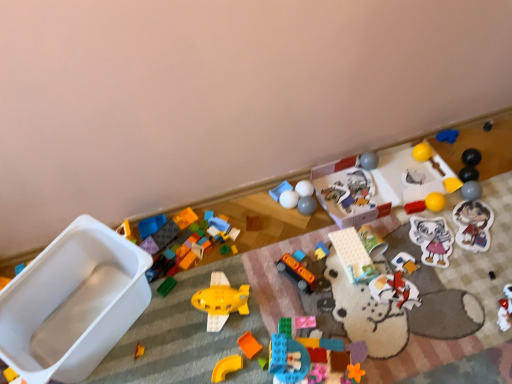
Question: Considering the relative positions of translucent plastic blocks at center, positioned as the 15th toy in right-to-left order, and orange matte bus at center, the tenth toy when ordered from left to right, in the image provided, is translucent plastic blocks at center, positioned as the 15th toy in right-to-left order, to the left or to the right of orange matte bus at center, the tenth toy when ordered from left to right,?

Choices:
 (A) right
 (B) left

Answer: (A)

Question: From the image's perspective, is translucent plastic blocks at center, arranged as the 11th toy when viewed from the left, positioned above or below orange matte bus at center, the sixteenth toy in the right-to-left sequence?

Choices:
 (A) below
 (B) above

Answer: (A)

Question: Estimate the real-world distances between objects in this image. Which object is closer to the matte plastic stickers at lower right, which is counted as the third toy, starting from the right?

Choices:
 (A) white matte balls at center, the ninth toy viewed from the left
 (B) rubber duck at center, which ranks as the eleventh toy in right-to-left order
 (C) green cardboard box at center, placed as the eighteenth toy when sorted from left to right
 (D) matte gray ball at right, which appears as the 24th toy when viewed from the left
 (E) white plastic container at left, which is the 1th toy in left-to-right order

Answer: (D)

Question: Which object is the closest to the translucent plastic blocks at center, which is the 24th toy from right to left?

Choices:
 (A) yellow plastic curve at center, which ranks as the 21th toy in right-to-left order
 (B) white plastic container at left, arranged as the 25th toy when viewed from the right
 (C) matte gray ball at right, which appears as the 24th toy when viewed from the left
 (D) matte plastic toy at center, acting as the 7th toy starting from the left
 (E) white matte ball at center, placed as the 13th toy when sorted from right to left

Answer: (D)